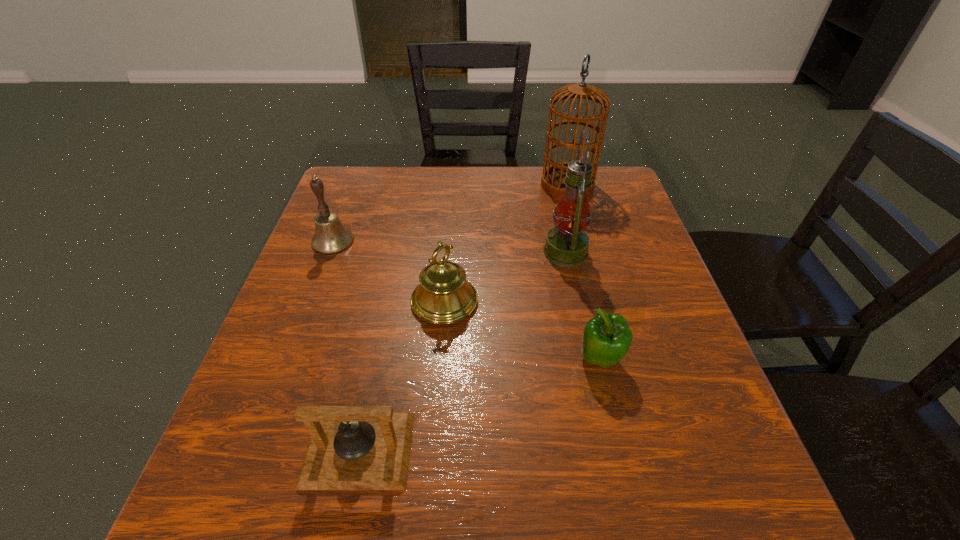
The height and width of the screenshot is (540, 960). Find the location of `free space in the image that satisfies the following two spatial constraints: 1. on the back side of the farthest object; 2. on the right side of the third nearest object`. free space in the image that satisfies the following two spatial constraints: 1. on the back side of the farthest object; 2. on the right side of the third nearest object is located at coordinates (454, 185).

I want to click on vacant space that satisfies the following two spatial constraints: 1. on the front side of the shortest object; 2. on the right side of the farthest bell, so click(254, 449).